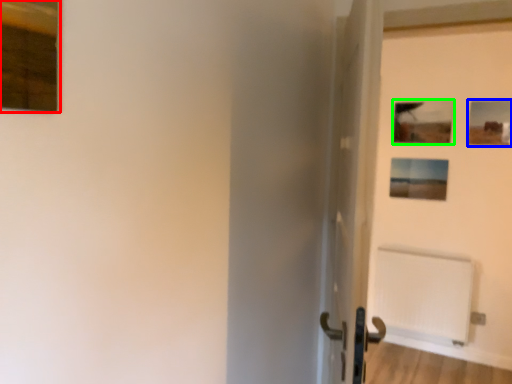
Question: Estimate the real-world distances between objects in this image. Which object is farther from picture frame (highlighted by a red box), picture frame (highlighted by a blue box) or picture frame (highlighted by a green box)?

Choices:
 (A) picture frame
 (B) picture frame

Answer: (A)